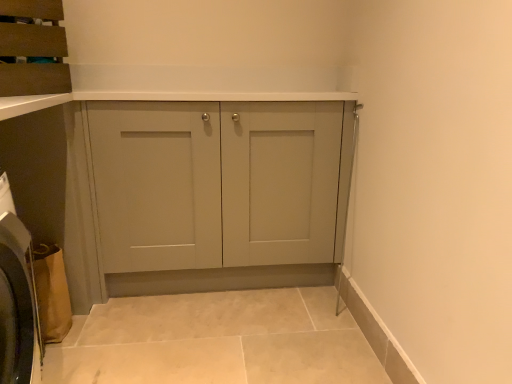
Question: From the image's perspective, is matte brown cabinet at upper left beneath brown fabric washing machine at lower left?

Choices:
 (A) yes
 (B) no

Answer: (B)

Question: Does matte brown cabinet at upper left contain brown fabric washing machine at lower left?

Choices:
 (A) yes
 (B) no

Answer: (B)

Question: Is matte brown cabinet at upper left not within brown fabric washing machine at lower left?

Choices:
 (A) yes
 (B) no

Answer: (A)

Question: From a real-world perspective, is matte brown cabinet at upper left under brown fabric washing machine at lower left?

Choices:
 (A) yes
 (B) no

Answer: (B)

Question: Considering the relative sizes of matte brown cabinet at upper left and brown fabric washing machine at lower left in the image provided, is matte brown cabinet at upper left bigger than brown fabric washing machine at lower left?

Choices:
 (A) yes
 (B) no

Answer: (A)

Question: Considering the relative positions of matte brown cabinet at upper left and brown fabric washing machine at lower left in the image provided, is matte brown cabinet at upper left to the left of brown fabric washing machine at lower left from the viewer's perspective?

Choices:
 (A) no
 (B) yes

Answer: (B)

Question: Can you confirm if brown fabric washing machine at lower left is wider than matte brown cabinet at upper left?

Choices:
 (A) no
 (B) yes

Answer: (A)

Question: Is brown fabric washing machine at lower left closer to the viewer compared to matte brown cabinet at upper left?

Choices:
 (A) no
 (B) yes

Answer: (A)

Question: Is brown fabric washing machine at lower left to the right of matte brown cabinet at upper left from the viewer's perspective?

Choices:
 (A) yes
 (B) no

Answer: (A)

Question: Considering the relative sizes of brown fabric washing machine at lower left and matte brown cabinet at upper left in the image provided, is brown fabric washing machine at lower left smaller than matte brown cabinet at upper left?

Choices:
 (A) yes
 (B) no

Answer: (A)

Question: Would you say brown fabric washing machine at lower left contains matte brown cabinet at upper left?

Choices:
 (A) yes
 (B) no

Answer: (B)

Question: Is brown fabric washing machine at lower left far from matte brown cabinet at upper left?

Choices:
 (A) no
 (B) yes

Answer: (A)

Question: Is matte brown cabinet at upper left shorter than matte gray cabinet at center?

Choices:
 (A) yes
 (B) no

Answer: (A)